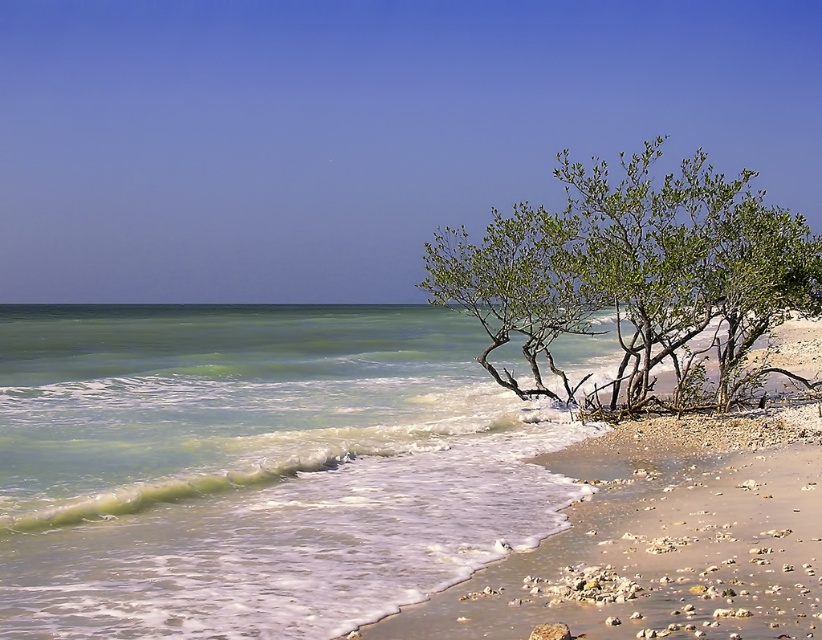
Question: Where is green translucent water at lower left located in relation to green leafy shrub at right in the image?

Choices:
 (A) above
 (B) below

Answer: (B)

Question: Which point is closer to the camera taking this photo?

Choices:
 (A) (682, 314)
 (B) (139, 394)

Answer: (A)

Question: Which of the following is the closest to the observer?

Choices:
 (A) (672, 173)
 (B) (122, 435)

Answer: (B)

Question: Is green translucent water at lower left to the left of green leafy shrub at right from the viewer's perspective?

Choices:
 (A) yes
 (B) no

Answer: (A)

Question: Is green translucent water at lower left further to camera compared to green leafy shrub at right?

Choices:
 (A) yes
 (B) no

Answer: (B)